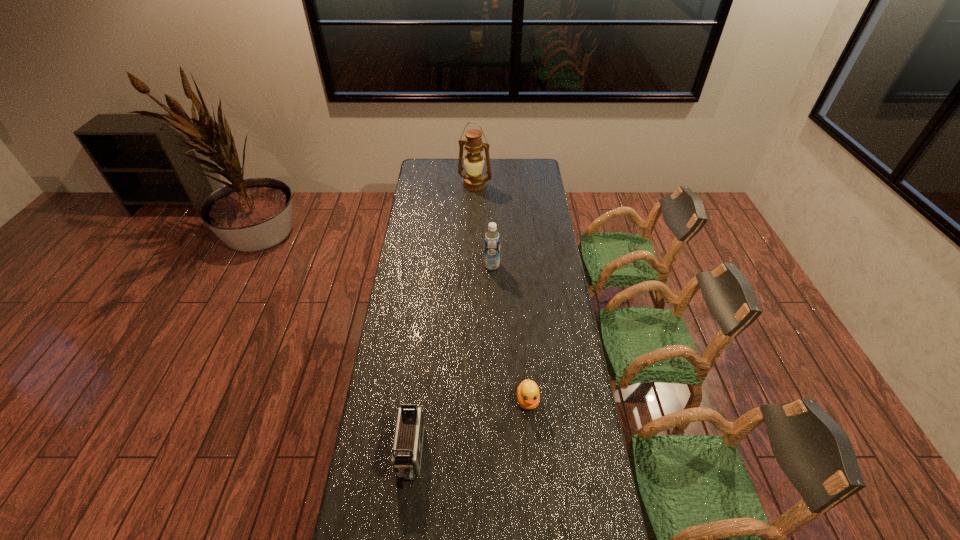
The height and width of the screenshot is (540, 960). What are the coordinates of `free location located 0.340m on the label of the third nearest object` in the screenshot? It's located at (413, 265).

The width and height of the screenshot is (960, 540). Identify the location of free space located on the label of the third nearest object. (420, 265).

This screenshot has width=960, height=540. I want to click on vacant region located 0.220m on the face of the rightmost object, so click(x=535, y=479).

Locate an element on the screen. Image resolution: width=960 pixels, height=540 pixels. object situated at the far edge is located at coordinates (474, 181).

Find the location of a particular element. The height and width of the screenshot is (540, 960). object positioned at the left edge is located at coordinates (407, 448).

This screenshot has width=960, height=540. In the image, there is a desktop. Identify the location of vacant space at the far edge. (492, 170).

You are a GUI agent. You are given a task and a screenshot of the screen. Output one action in this format:
    pyautogui.click(x=<x>, y=<y>)
    Task: Click on the blank space at the left edge of the desktop
    Image resolution: width=960 pixels, height=540 pixels.
    Given the screenshot: What is the action you would take?
    pyautogui.click(x=424, y=322)

At what (x,y) coordinates should I click in order to perform the action: click on free region at the right edge of the desktop. Please return your answer as a coordinate pair (x, y). Image resolution: width=960 pixels, height=540 pixels. Looking at the image, I should click on (557, 260).

In the image, there is a desktop. At what (x,y) coordinates should I click in order to perform the action: click on free space at the far left corner. Please return your answer as a coordinate pair (x, y). The width and height of the screenshot is (960, 540). Looking at the image, I should click on (436, 163).

The image size is (960, 540). I want to click on free point between the oil lamp and the third farthest object, so click(x=501, y=293).